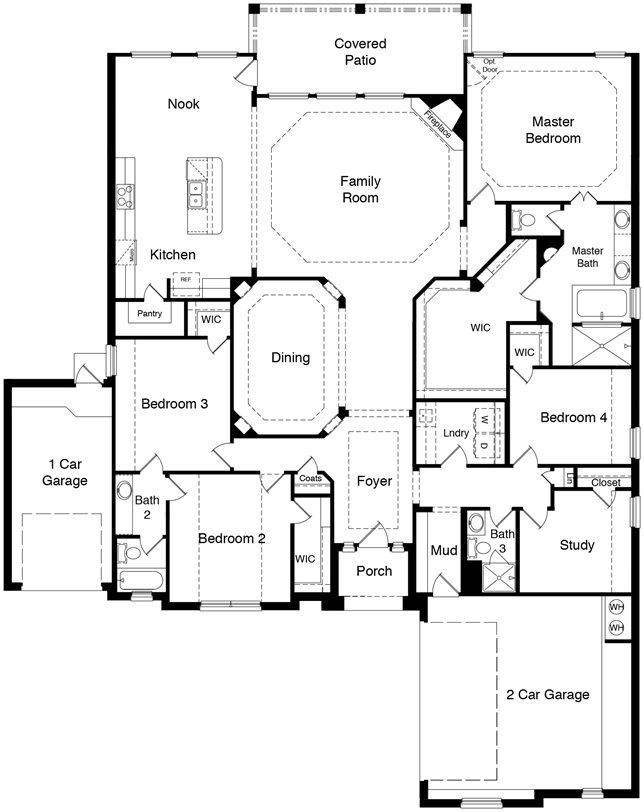
I want to click on closets and storage spaces, so click(459, 361), click(451, 417), click(439, 527), click(594, 477), click(151, 317), click(211, 318), click(315, 486).